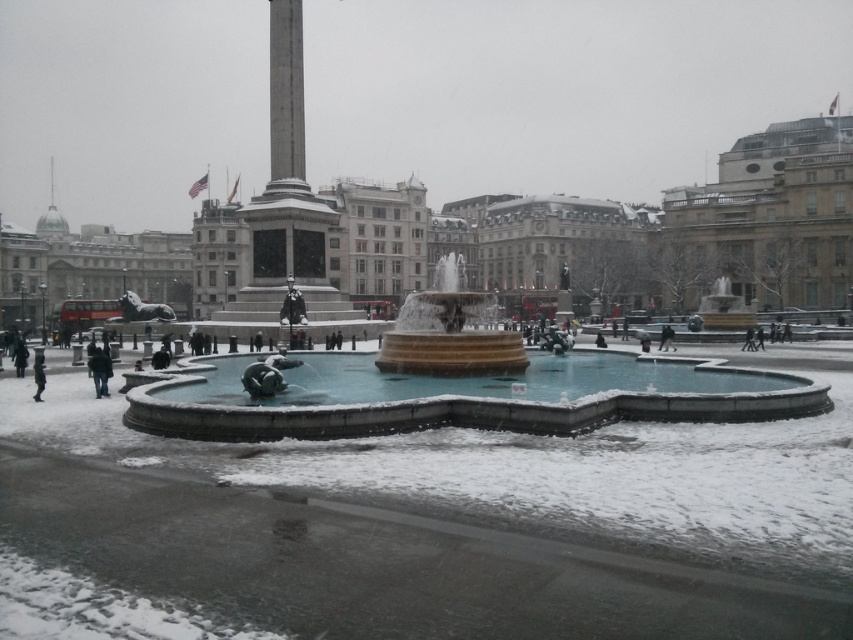
Question: Which point appears farthest from the camera in this image?

Choices:
 (A) (672, 348)
 (B) (318, 257)
 (C) (712, 376)

Answer: (B)

Question: Which object appears closest to the camera in this image?

Choices:
 (A) black leather jacket at lower center
 (B) yellow stone fountain at center

Answer: (B)

Question: Is gold stone fountain at center smaller than yellow stone fountain at center?

Choices:
 (A) yes
 (B) no

Answer: (A)

Question: Does yellow stone fountain at center appear under dark gray fabric jacket at lower left?

Choices:
 (A) yes
 (B) no

Answer: (B)

Question: Is yellow stone fountain at center closer to camera compared to black leather jacket at lower center?

Choices:
 (A) no
 (B) yes

Answer: (B)

Question: Considering the real-world distances, which object is farthest from the gold stone fountain at center?

Choices:
 (A) polished stone obelisk at center
 (B) black leather jacket at lower center
 (C) yellow stone fountain at center
 (D) dark gray jacket at lower left

Answer: (A)